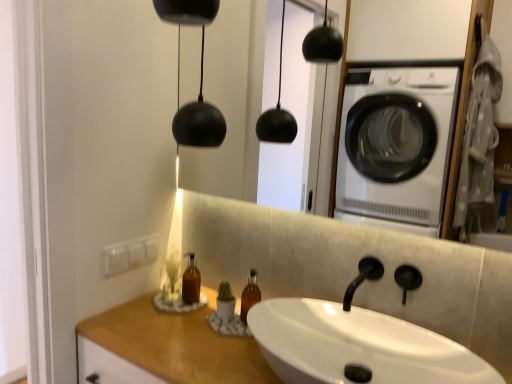
Where is `free location above wooden counter top at lower left (from a real-world perspective)`? The width and height of the screenshot is (512, 384). free location above wooden counter top at lower left (from a real-world perspective) is located at coordinates (196, 337).